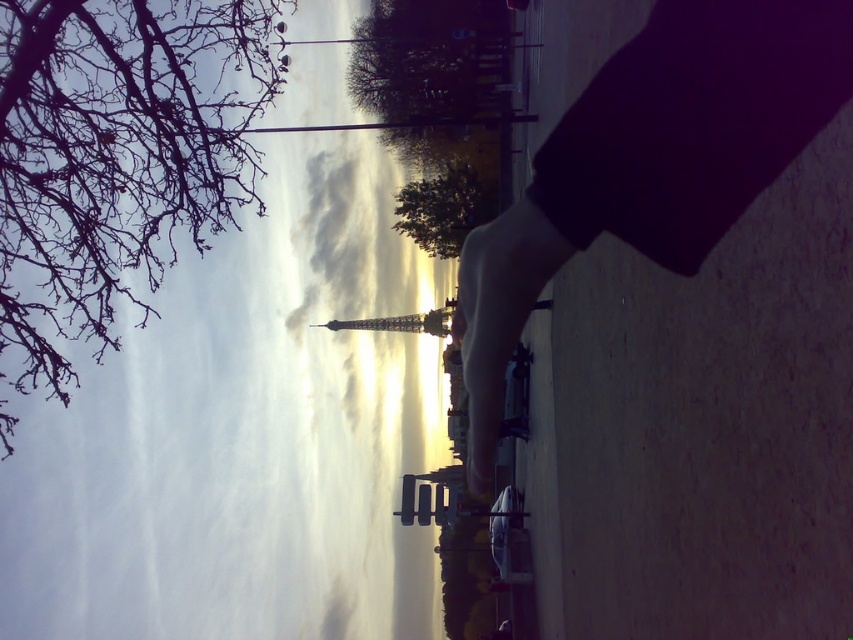
Question: Which of the following is the farthest from the observer?

Choices:
 (A) (461, 260)
 (B) (448, 173)

Answer: (B)

Question: Where is bare branches at upper left located in relation to smooth black skateboard at center in the image?

Choices:
 (A) below
 (B) above

Answer: (B)

Question: Which point is closer to the camera?

Choices:
 (A) bare branches at upper left
 (B) smooth black skateboard at center
 (C) green leafy tree at center

Answer: (B)

Question: Does smooth black skateboard at center have a lesser width compared to green leafy tree at center?

Choices:
 (A) yes
 (B) no

Answer: (A)

Question: Can you confirm if bare branches at upper left is positioned to the left of green leafy tree at center?

Choices:
 (A) yes
 (B) no

Answer: (A)

Question: Which of the following is the farthest from the observer?

Choices:
 (A) (479, 211)
 (B) (555, 220)
 (C) (94, 4)

Answer: (A)